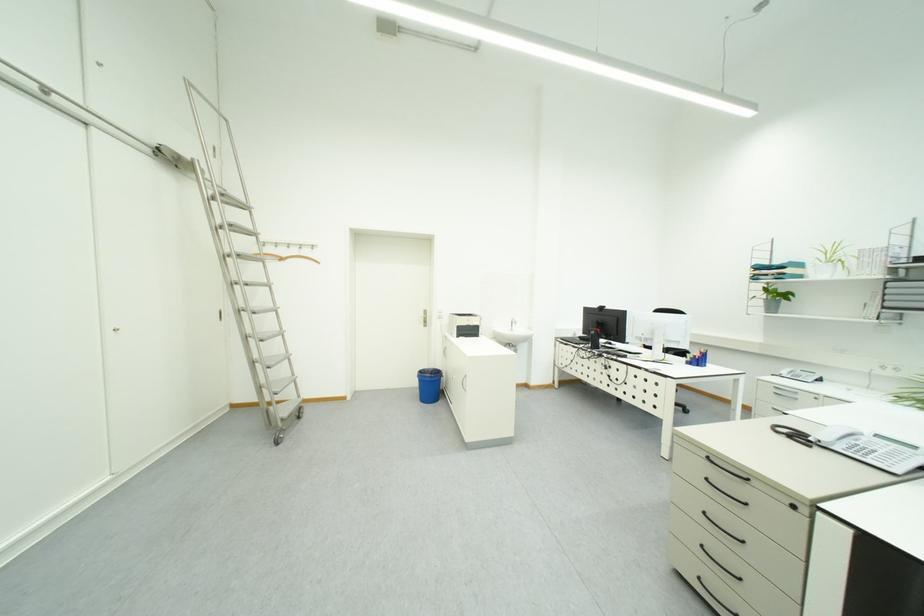
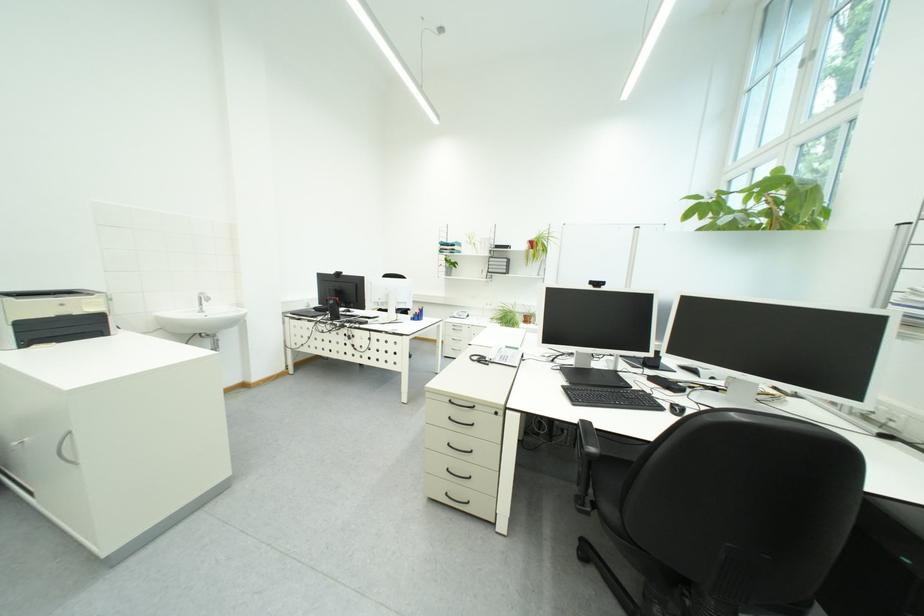
In the second image, find the point that corresponds to pixel 658 341 in the first image.

(394, 305)